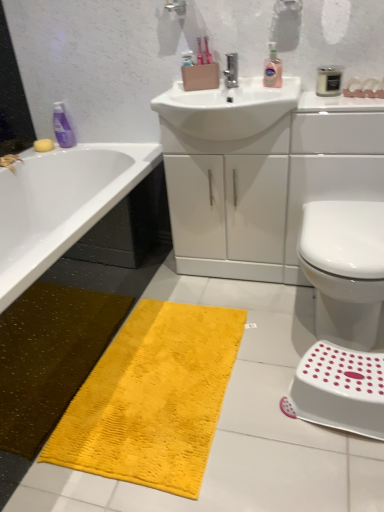
I want to click on free point in front of white matte jar at upper right, marked as the 2th mouthwash in a back-to-front arrangement, so click(345, 103).